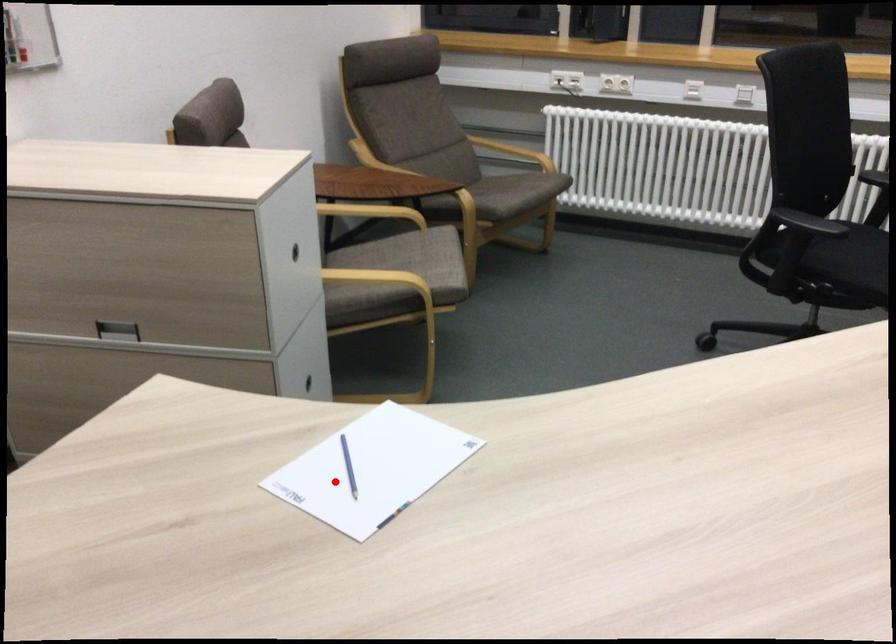
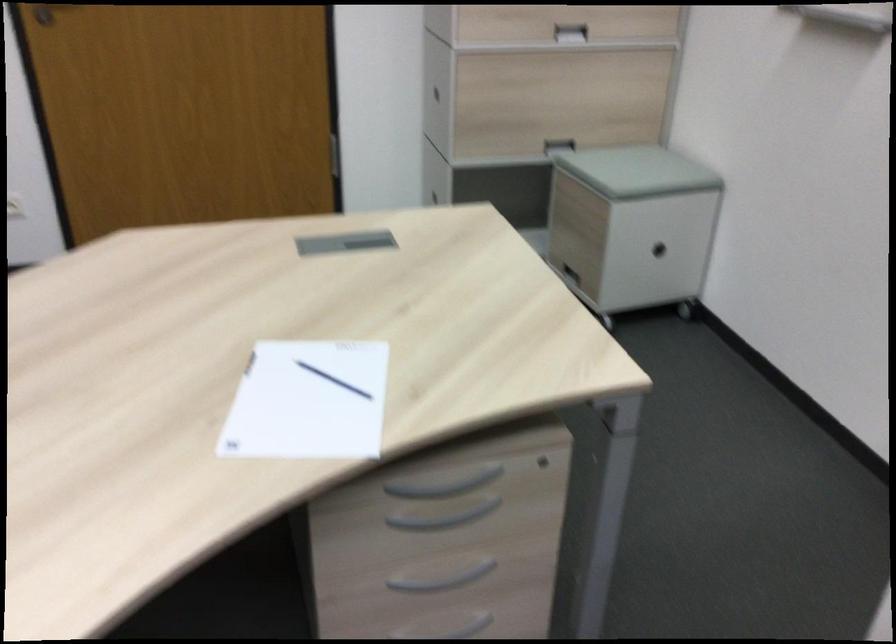
Where in the second image is the point corresponding to the highlighted location from the first image?

(333, 380)